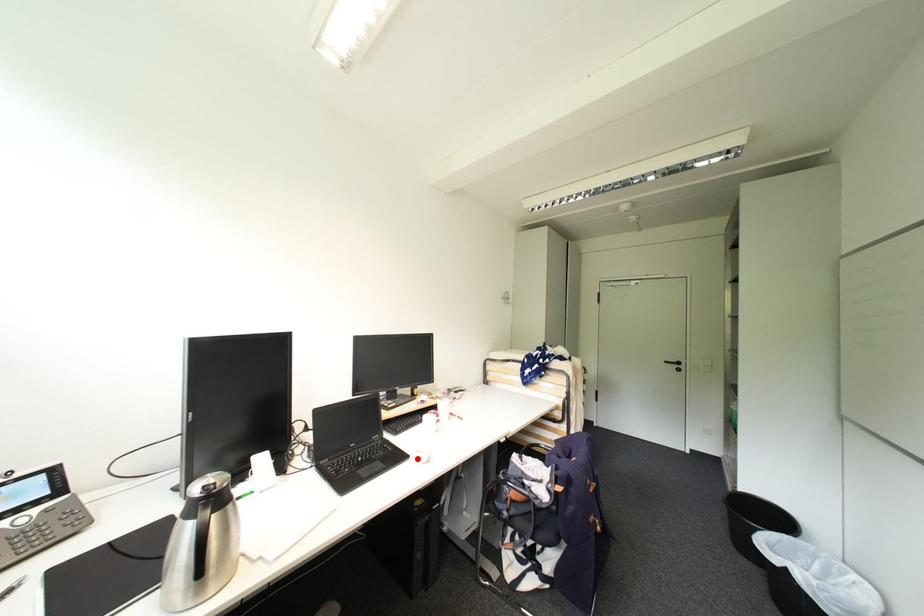
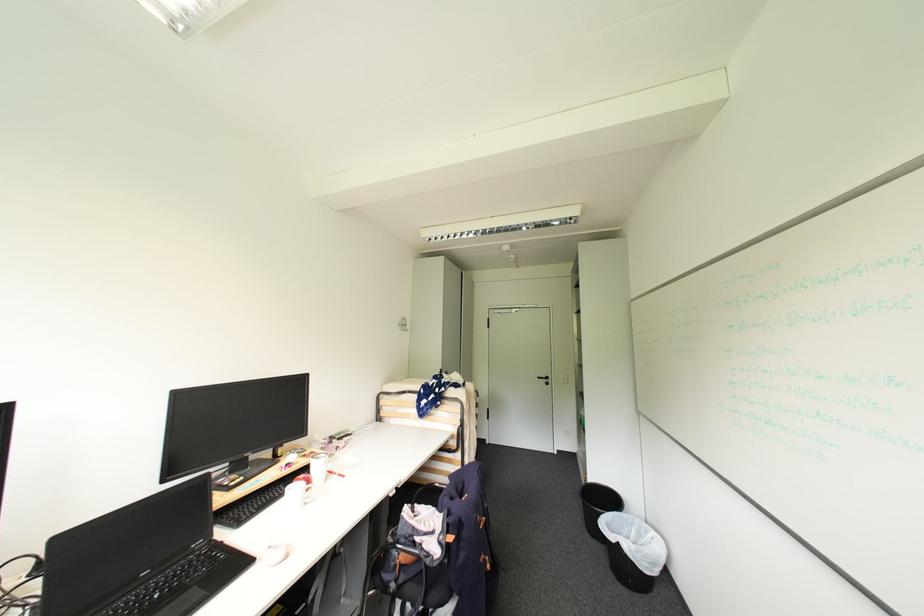
Where in the second image is the point corresponding to the highlighted location from the first image?

(263, 562)